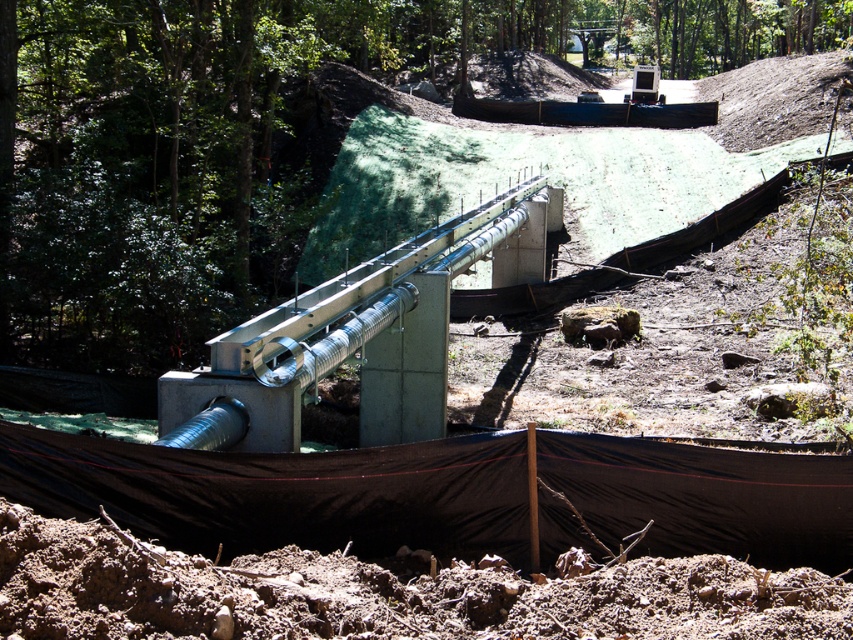
Is green textured fabric at center to the right of silver metallic rail at center from the viewer's perspective?

Yes, green textured fabric at center is to the right of silver metallic rail at center.

Between green textured fabric at center and silver metallic rail at center, which one is positioned lower?

silver metallic rail at center

Where is `green textured fabric at center`? This screenshot has height=640, width=853. green textured fabric at center is located at coordinates (263, 136).

Where is `green textured fabric at center`? The height and width of the screenshot is (640, 853). green textured fabric at center is located at coordinates (263, 136).